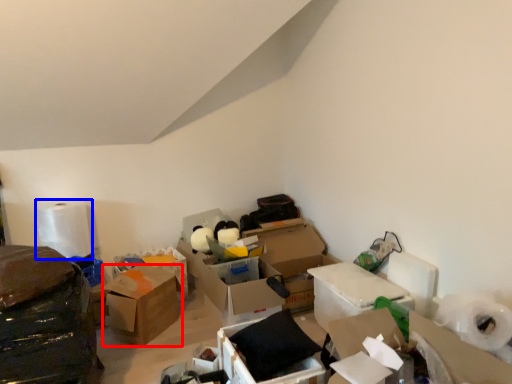
Question: Which object is closer to the camera taking this photo, box (highlighted by a red box) or toilet paper (highlighted by a blue box)?

Choices:
 (A) box
 (B) toilet paper

Answer: (A)